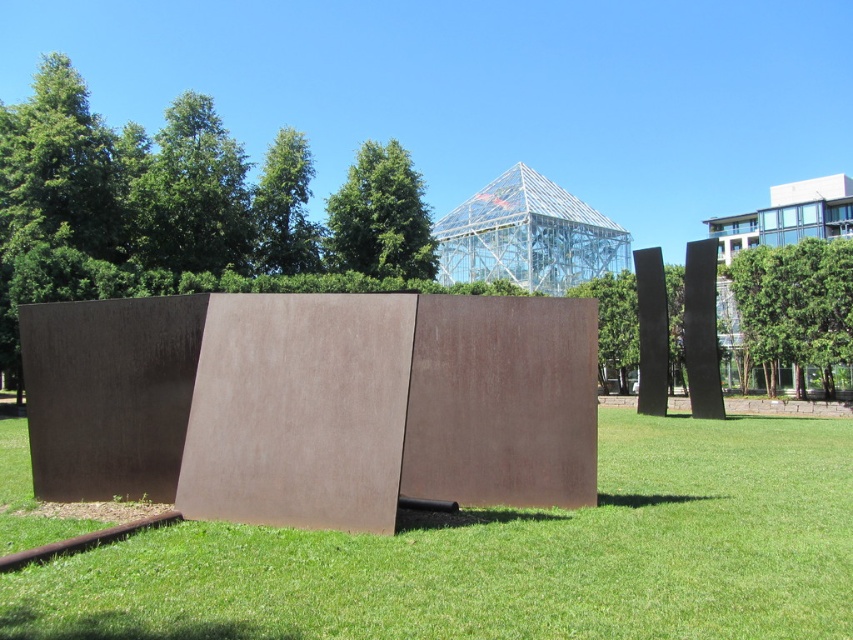
Is green grass at center taller than transparent glass pyramid at upper center?

In fact, green grass at center may be shorter than transparent glass pyramid at upper center.

Who is more forward, [531,518] or [479,250]?

Point [531,518]

Between point (795, 547) and point (445, 214), which one is positioned behind?

The point (445, 214) is more distant.

Identify the location of green grass at center. This screenshot has width=853, height=640. (509, 556).